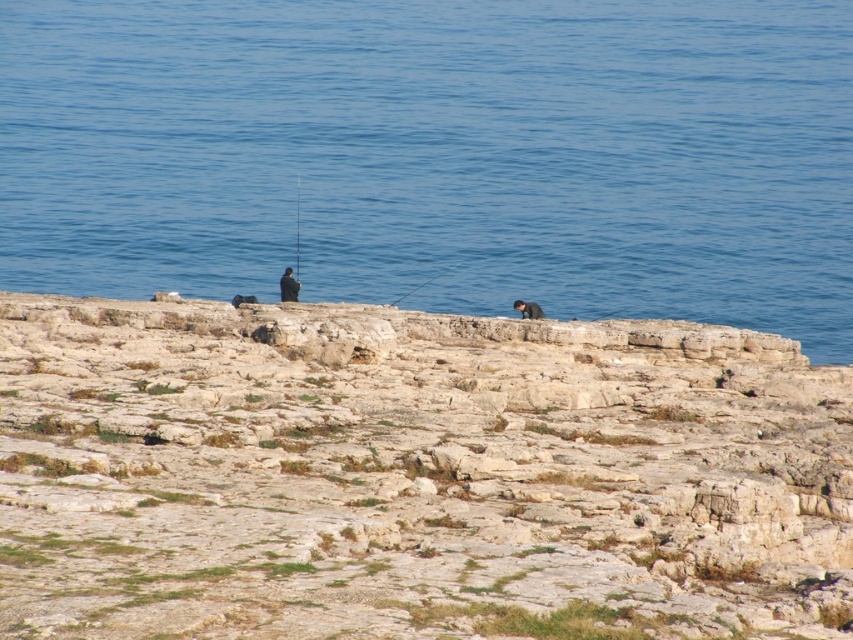
Question: Is rough stone hillside at center closer to the viewer compared to dark blue wetsuit at center?

Choices:
 (A) yes
 (B) no

Answer: (A)

Question: Which of these objects is positioned farthest from the smooth black rod at center?

Choices:
 (A) dark blue fabric jacket at center
 (B) blue water at center
 (C) black plastic fishing pole at center

Answer: (B)

Question: Does blue water at center appear under smooth black rod at center?

Choices:
 (A) yes
 (B) no

Answer: (B)

Question: Which of these objects is positioned closest to the dark blue wetsuit at center?

Choices:
 (A) black plastic fishing pole at center
 (B) dark blue fabric jacket at center

Answer: (B)

Question: Which point appears closest to the camera in this image?

Choices:
 (A) (74, 336)
 (B) (158, 99)

Answer: (A)

Question: Can you confirm if dark blue fabric jacket at center is positioned to the left of dark blue wetsuit at center?

Choices:
 (A) no
 (B) yes

Answer: (B)